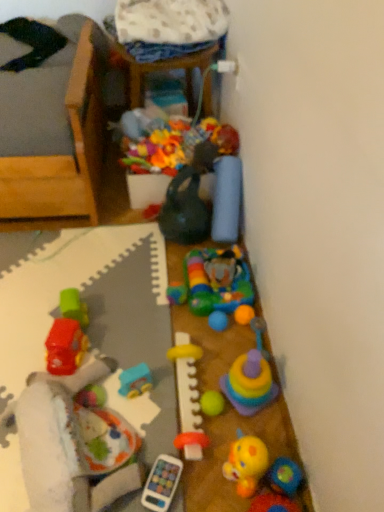
In order to click on vacant location behind rubberized plastic stacking cups at center-right, which is counted as the 3th toy, starting from the right in this screenshot , I will do `click(224, 338)`.